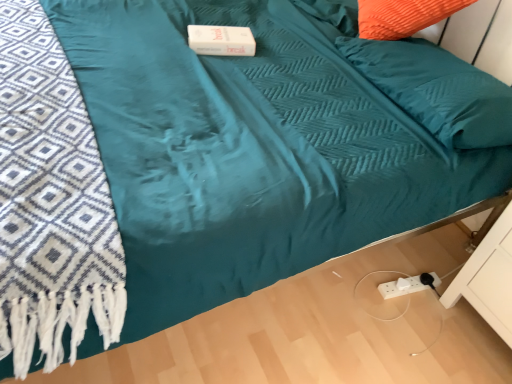
Question: Is teal fabric pillow at upper right shorter than white matte drawer at lower right?

Choices:
 (A) no
 (B) yes

Answer: (B)

Question: From a real-world perspective, is teal fabric pillow at upper right physically below white matte drawer at lower right?

Choices:
 (A) no
 (B) yes

Answer: (A)

Question: From the image's perspective, is teal fabric pillow at upper right over white matte drawer at lower right?

Choices:
 (A) yes
 (B) no

Answer: (A)

Question: Does teal fabric pillow at upper right have a smaller size compared to white matte drawer at lower right?

Choices:
 (A) yes
 (B) no

Answer: (A)

Question: Does teal fabric pillow at upper right have a lesser width compared to white matte drawer at lower right?

Choices:
 (A) no
 (B) yes

Answer: (A)

Question: Is teal fabric pillow at upper right behind white matte drawer at lower right?

Choices:
 (A) yes
 (B) no

Answer: (A)

Question: Does white matte drawer at lower right appear on the right side of teal fabric pillow at upper right?

Choices:
 (A) yes
 (B) no

Answer: (A)

Question: Does white matte drawer at lower right have a smaller size compared to teal fabric pillow at upper right?

Choices:
 (A) no
 (B) yes

Answer: (A)

Question: Is white matte drawer at lower right outside of teal fabric pillow at upper right?

Choices:
 (A) yes
 (B) no

Answer: (A)

Question: Is white matte drawer at lower right looking in the opposite direction of teal fabric pillow at upper right?

Choices:
 (A) yes
 (B) no

Answer: (B)

Question: Could you tell me if white matte drawer at lower right is facing teal fabric pillow at upper right?

Choices:
 (A) yes
 (B) no

Answer: (B)

Question: Is the position of white matte drawer at lower right more distant than that of teal fabric pillow at upper right?

Choices:
 (A) yes
 (B) no

Answer: (B)

Question: From the image's perspective, relative to teal fabric pillow at upper right, is white matte drawer at lower right above or below?

Choices:
 (A) above
 (B) below

Answer: (B)